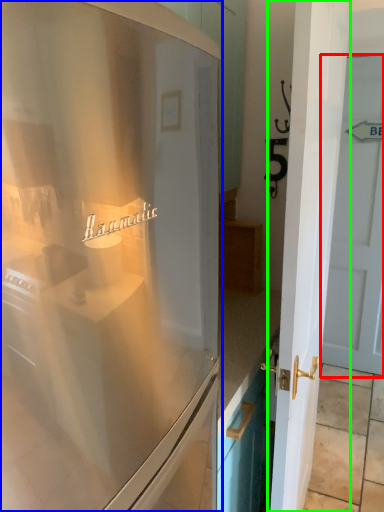
Question: Which object is the farthest from door (highlighted by a red box)? Choose among these: refrigerator (highlighted by a blue box) or door (highlighted by a green box).

Choices:
 (A) refrigerator
 (B) door

Answer: (A)